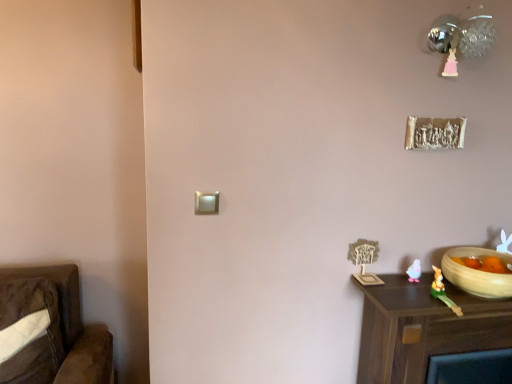
Question: Should I look upward or downward to see green rubber rabbit at lower right, arranged as the 1th toy when viewed from the front?

Choices:
 (A) down
 (B) up

Answer: (A)

Question: From a real-world perspective, is pink plastic toy at lower right, the 2th toy when ordered from front to back, physically below beige ceramic bowl at lower right?

Choices:
 (A) no
 (B) yes

Answer: (B)

Question: Is pink plastic toy at lower right, marked as the first toy in a back-to-front arrangement, looking in the opposite direction of beige ceramic bowl at lower right?

Choices:
 (A) yes
 (B) no

Answer: (B)

Question: Is pink plastic toy at lower right, the 2th toy when ordered from front to back, aimed at beige ceramic bowl at lower right?

Choices:
 (A) no
 (B) yes

Answer: (A)

Question: Can you confirm if pink plastic toy at lower right, the 2th toy when ordered from front to back, is shorter than beige ceramic bowl at lower right?

Choices:
 (A) yes
 (B) no

Answer: (A)

Question: From the image's perspective, is pink plastic toy at lower right, marked as the first toy in a back-to-front arrangement, under beige ceramic bowl at lower right?

Choices:
 (A) yes
 (B) no

Answer: (B)

Question: Is pink plastic toy at lower right, the 2th toy when ordered from front to back, taller than beige ceramic bowl at lower right?

Choices:
 (A) yes
 (B) no

Answer: (B)

Question: Would you say brown wood nightstand at lower right is outside metallic sphere at upper right?

Choices:
 (A) no
 (B) yes

Answer: (B)

Question: Is brown wood nightstand at lower right facing away from metallic sphere at upper right?

Choices:
 (A) yes
 (B) no

Answer: (B)

Question: Can you confirm if brown wood nightstand at lower right is shorter than metallic sphere at upper right?

Choices:
 (A) no
 (B) yes

Answer: (A)

Question: Can you confirm if brown wood nightstand at lower right is thinner than metallic sphere at upper right?

Choices:
 (A) yes
 (B) no

Answer: (B)

Question: Is brown wood nightstand at lower right directly adjacent to metallic sphere at upper right?

Choices:
 (A) no
 (B) yes

Answer: (A)

Question: Is brown wood nightstand at lower right at the left side of metallic sphere at upper right?

Choices:
 (A) no
 (B) yes

Answer: (A)

Question: Is brown wood nightstand at lower right oriented towards green rubber rabbit at lower right, arranged as the 1th toy when viewed from the front?

Choices:
 (A) no
 (B) yes

Answer: (A)